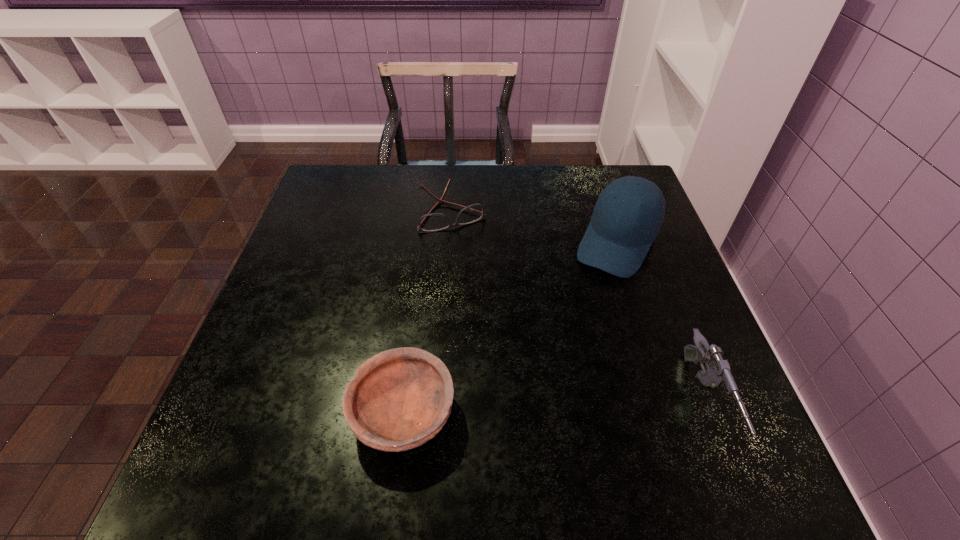
The width and height of the screenshot is (960, 540). Identify the location of the second shortest object. (401, 398).

This screenshot has width=960, height=540. What are the coordinates of `the third shortest object` in the screenshot? It's located at (717, 374).

Find the location of a particular element. This screenshot has height=540, width=960. baseball cap is located at coordinates (629, 212).

I want to click on the shortest object, so click(x=431, y=222).

This screenshot has width=960, height=540. What are the coordinates of `free spot located on the left of the third tallest object` in the screenshot? It's located at [249, 413].

Locate an element on the screen. This screenshot has height=540, width=960. vacant space situated 0.310m on the front-facing side of the baseball cap is located at coordinates (549, 370).

Locate an element on the screen. vacant space located on the front-facing side of the baseball cap is located at coordinates (532, 402).

Find the location of `free space located 0.320m on the front-facing side of the baseball cap`. free space located 0.320m on the front-facing side of the baseball cap is located at coordinates (547, 374).

At what (x,y) coordinates should I click in order to perform the action: click on vacant space situated 0.330m on the front-facing side of the spectacles. Please return your answer as a coordinate pair (x, y). The width and height of the screenshot is (960, 540). Looking at the image, I should click on (509, 327).

Where is `vacant space located 0.360m on the front-facing side of the spectacles`? This screenshot has width=960, height=540. vacant space located 0.360m on the front-facing side of the spectacles is located at coordinates (515, 337).